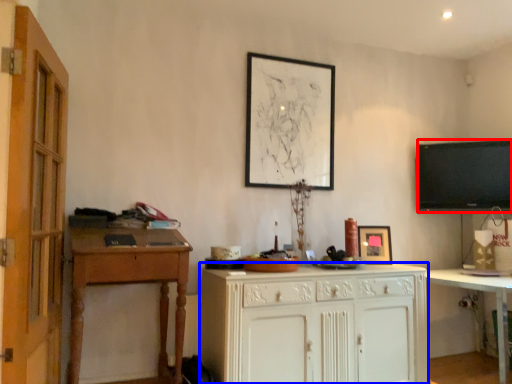
Question: Which object appears closest to the camera in this image, television (highlighted by a red box) or cabinetry (highlighted by a blue box)?

Choices:
 (A) television
 (B) cabinetry

Answer: (B)